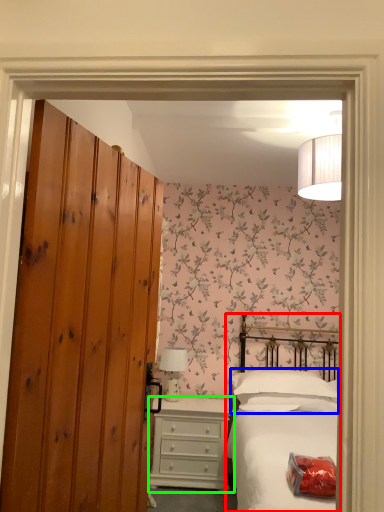
Question: Which is farther away from bed (highlighted by a red box)? pillow (highlighted by a blue box) or chest of drawers (highlighted by a green box)?

Choices:
 (A) pillow
 (B) chest of drawers

Answer: (B)